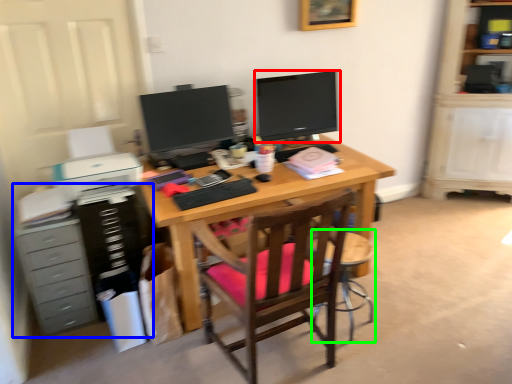
Question: Estimate the real-world distances between objects in this image. Which object is farther from television (highlighted by a red box), dresser (highlighted by a blue box) or computer chair (highlighted by a green box)?

Choices:
 (A) dresser
 (B) computer chair

Answer: (A)